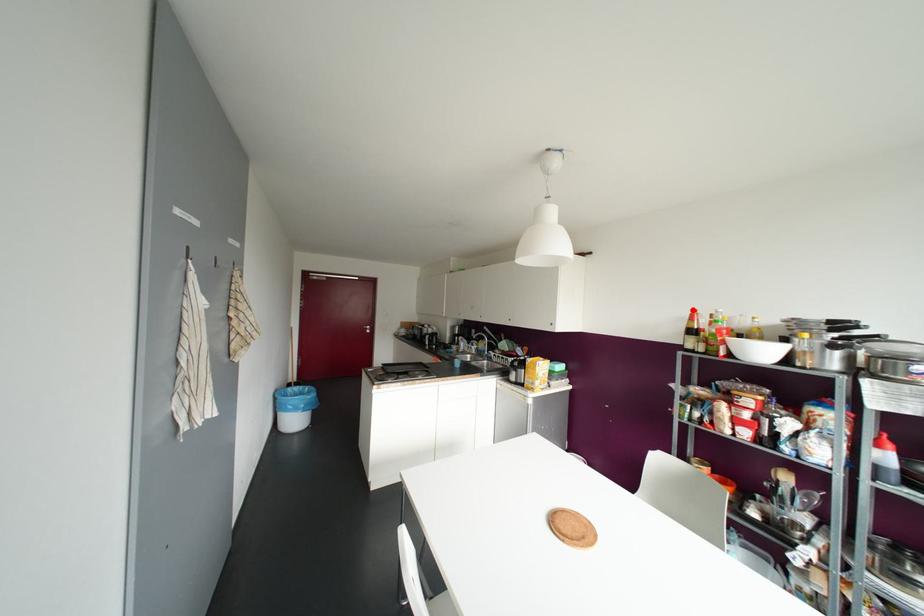
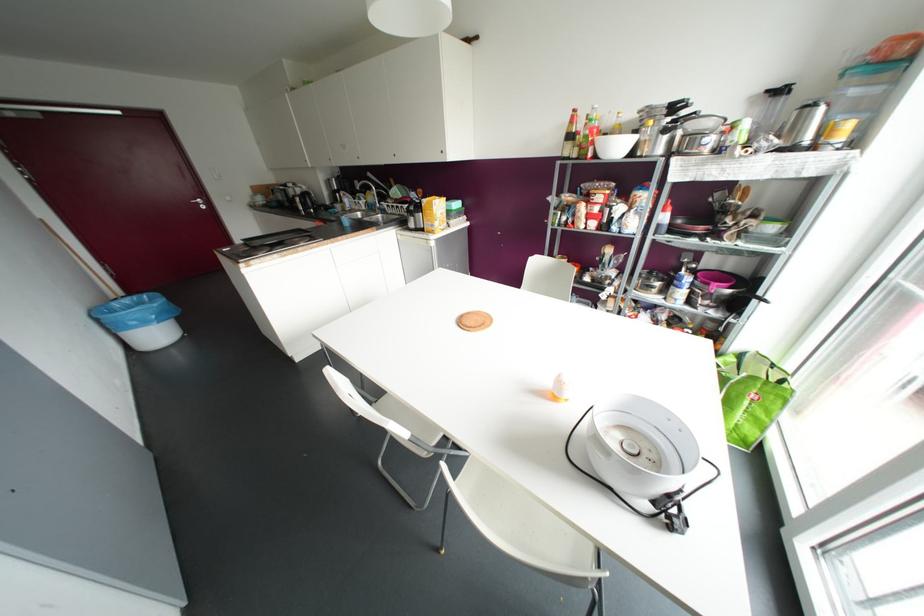
The point at the highlighted location is marked in the first image. Where is the corresponding point in the second image?

(574, 110)